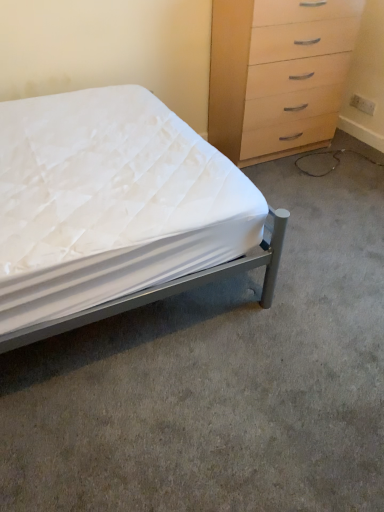
Locate an element on the screen. The width and height of the screenshot is (384, 512). vacant space to the right of light wood/wooden chest of drawers at upper right is located at coordinates (340, 158).